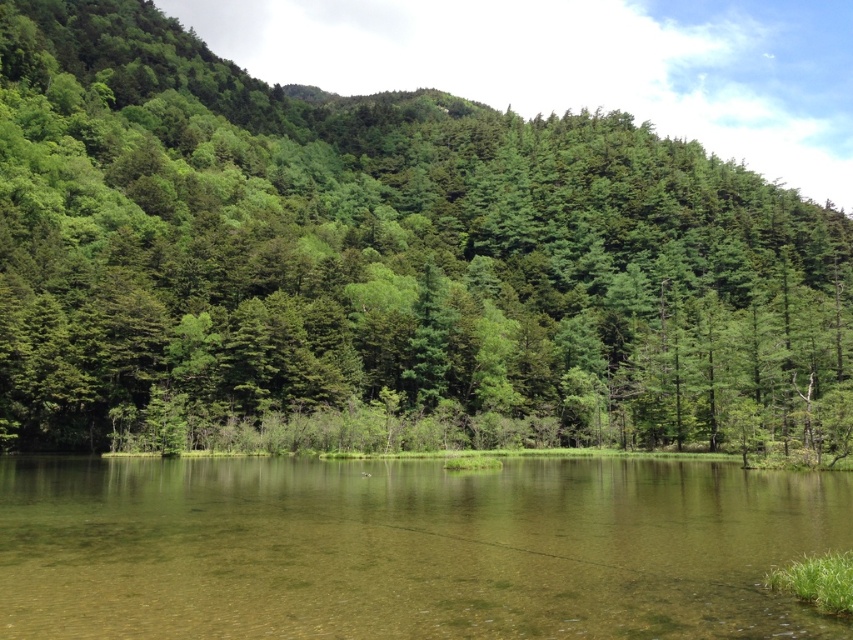
You are a hiker standing at the edge of the lake. You notice a green matte tree at center and a clear water at center. Which object appears bigger in the scene?

The green matte tree at center appears larger in size than the clear water at center.

You are standing at the origin point of the coordinate system. What are the coordinates of the green matte tree at center?

The coordinates of the green matte tree at center are at point (x=383, y=259).

You are standing on the lakeshore and see the green matte tree at center and the clear water at center. Which object is positioned more to the east if the lake faces north?

The green matte tree at center is positioned more to the east since it is to the right of the clear water at center, and if the lake faces north, the right side would correspond to the east direction.